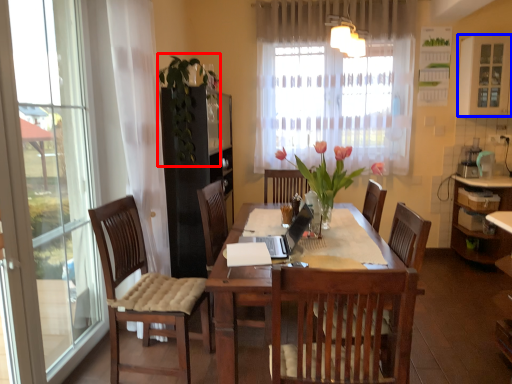
Question: Which point is further to the camera, floral arrangement (highlighted by a red box) or window (highlighted by a blue box)?

Choices:
 (A) floral arrangement
 (B) window

Answer: (B)